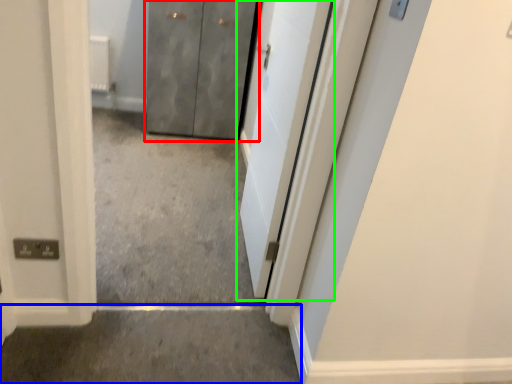
Question: Considering the real-world distances, which object is farthest from door (highlighted by a red box)? concrete (highlighted by a blue box) or door (highlighted by a green box)?

Choices:
 (A) concrete
 (B) door

Answer: (A)